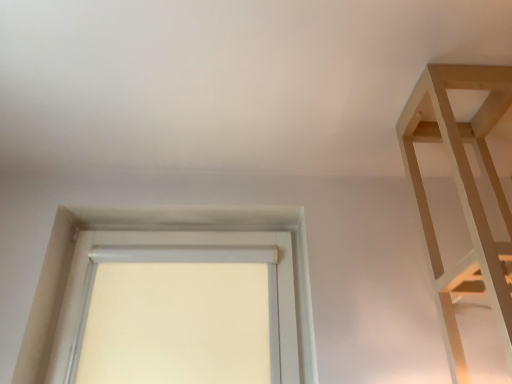
Image resolution: width=512 pixels, height=384 pixels. In order to click on white fabric window at center in this screenshot , I will do `click(178, 244)`.

Image resolution: width=512 pixels, height=384 pixels. What do you see at coordinates (178, 244) in the screenshot? I see `white fabric window at center` at bounding box center [178, 244].

Describe the element at coordinates (463, 194) in the screenshot. I see `light wood shelf at upper right` at that location.

Locate an element on the screen. The image size is (512, 384). light wood shelf at upper right is located at coordinates (463, 194).

Identify the location of white fabric window at center. (178, 244).

Is light wood shelf at upper right at the right side of white fabric window at center?

Yes, light wood shelf at upper right is to the right of white fabric window at center.

Considering their positions, is light wood shelf at upper right located in front of or behind white fabric window at center?

light wood shelf at upper right is positioned closer to the viewer than white fabric window at center.

Which is behind, point (457, 185) or point (288, 347)?

The point (288, 347) is farther from the camera.

From the image's perspective, is light wood shelf at upper right located above or below white fabric window at center?

light wood shelf at upper right is above white fabric window at center.

From a real-world perspective, between light wood shelf at upper right and white fabric window at center, who is vertically higher?

light wood shelf at upper right.

Considering the sizes of objects light wood shelf at upper right and white fabric window at center in the image provided, who is thinner, light wood shelf at upper right or white fabric window at center?

white fabric window at center is thinner.

Based on the photo, considering the sizes of objects light wood shelf at upper right and white fabric window at center in the image provided, who is taller, light wood shelf at upper right or white fabric window at center?

With more height is light wood shelf at upper right.

From the picture: Can you confirm if light wood shelf at upper right is bigger than white fabric window at center?

Yes, light wood shelf at upper right is bigger than white fabric window at center.

Is white fabric window at center completely or partially inside light wood shelf at upper right?

No, white fabric window at center is located outside of light wood shelf at upper right.

Is light wood shelf at upper right directly adjacent to white fabric window at center?

light wood shelf at upper right is not next to white fabric window at center, and they're not touching.

From the picture: Is light wood shelf at upper right aimed at white fabric window at center?

No, light wood shelf at upper right is not turned towards white fabric window at center.

Can you tell me how much light wood shelf at upper right and white fabric window at center differ in facing direction?

There is a 0.4-degree angle between the facing directions of light wood shelf at upper right and white fabric window at center.

How much distance is there between light wood shelf at upper right and white fabric window at center?

They are 28.24 inches apart.

Image resolution: width=512 pixels, height=384 pixels. What are the coordinates of `window that appears behind the light wood shelf at upper right` in the screenshot? It's located at (178, 244).

Considering the relative positions of white fabric window at center and light wood shelf at upper right in the image provided, is white fabric window at center to the left of light wood shelf at upper right from the viewer's perspective?

Yes, white fabric window at center is to the left of light wood shelf at upper right.

Is white fabric window at center closer to camera compared to light wood shelf at upper right?

No.

Does point (287, 288) appear closer or farther from the camera than point (479, 137)?

Point (287, 288) is positioned farther from the camera compared to point (479, 137).

From the image's perspective, which is below, white fabric window at center or light wood shelf at upper right?

white fabric window at center is shown below in the image.

From a real-world perspective, is white fabric window at center on top of light wood shelf at upper right?

No.

Looking at their sizes, would you say white fabric window at center is wider or thinner than light wood shelf at upper right?

white fabric window at center is thinner than light wood shelf at upper right.

From their relative heights in the image, would you say white fabric window at center is taller or shorter than light wood shelf at upper right?

white fabric window at center is shorter than light wood shelf at upper right.

Which of these two, white fabric window at center or light wood shelf at upper right, is bigger?

light wood shelf at upper right is bigger.

Is white fabric window at center completely or partially outside of light wood shelf at upper right?

Absolutely, white fabric window at center is external to light wood shelf at upper right.

Based on the photo, is there a large distance between white fabric window at center and light wood shelf at upper right?

No, white fabric window at center is not far from light wood shelf at upper right.

Is white fabric window at center positioned with its back to light wood shelf at upper right?

No.

What are the coordinates of `window on the left of light wood shelf at upper right` in the screenshot? It's located at (178, 244).

Find the location of a particular element. shelf on the right of white fabric window at center is located at coordinates (463, 194).

Locate an element on the screen. Image resolution: width=512 pixels, height=384 pixels. shelf above the white fabric window at center (from a real-world perspective) is located at coordinates (463, 194).